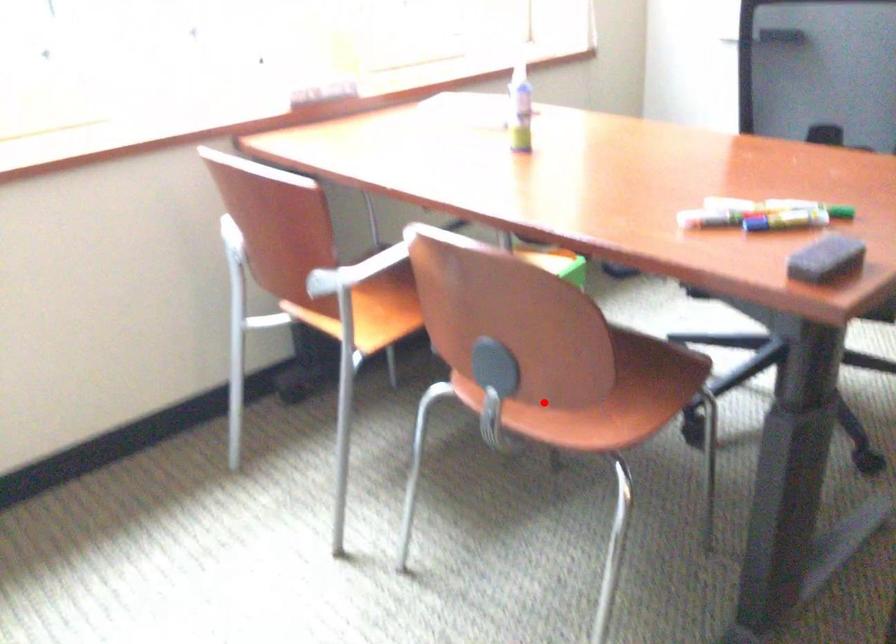
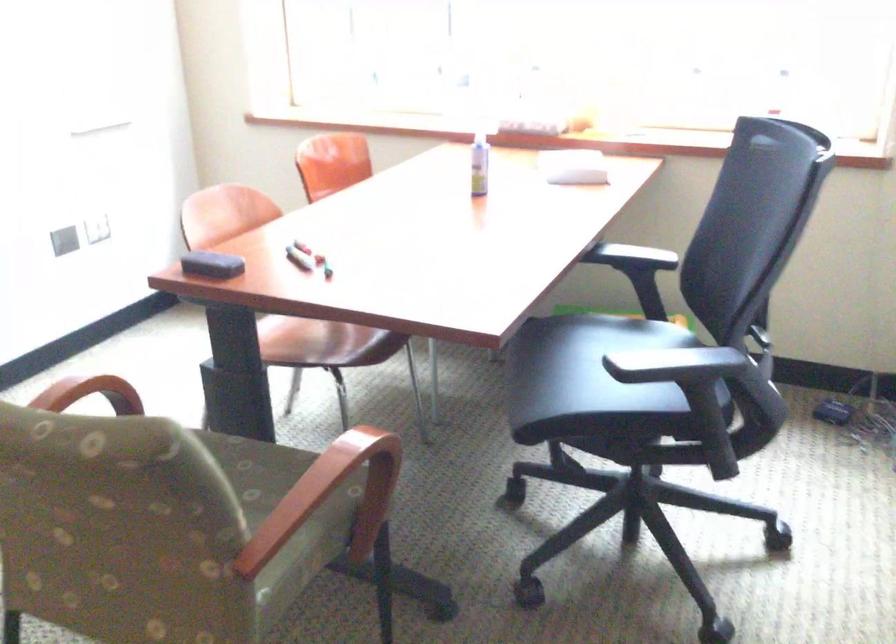
In the second image, find the point that corresponds to the highlighted location in the first image.

(295, 336)